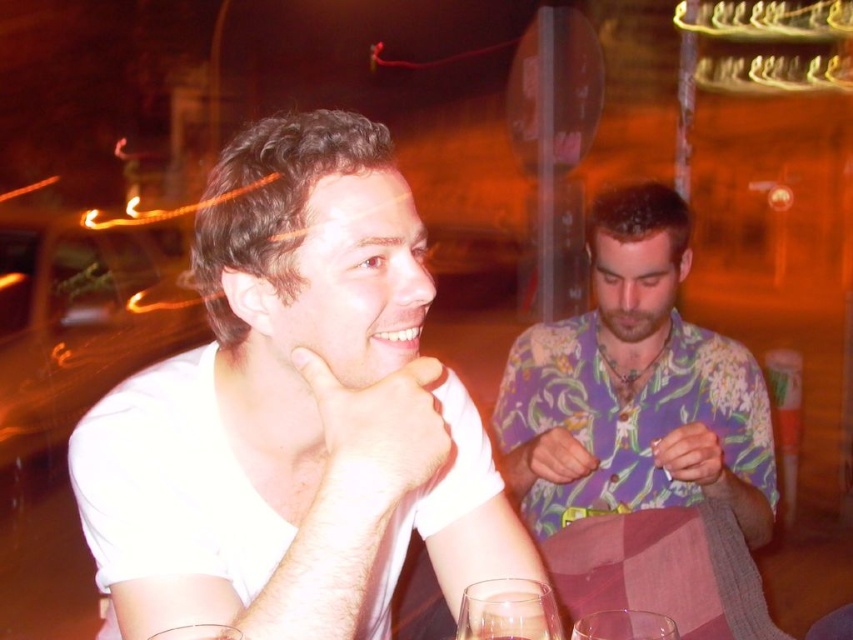
Who is more distant from viewer, (238, 589) or (485, 579)?

Point (238, 589)

Is white matte shirt at left smaller than clear glass wine glass at lower center?

Actually, white matte shirt at left might be larger than clear glass wine glass at lower center.

This screenshot has height=640, width=853. Describe the element at coordinates (294, 410) in the screenshot. I see `white matte shirt at left` at that location.

At what (x,y) coordinates should I click in order to perform the action: click on white matte shirt at left. Please return your answer as a coordinate pair (x, y). Looking at the image, I should click on (294, 410).

Which of these two, transparent glass at lower center or beardhairjaw at center, stands taller?

beardhairjaw at center

Does point (664, 628) come farther from viewer compared to point (668, 316)?

No.

At what (x,y) coordinates should I click in order to perform the action: click on transparent glass at lower center. Please return your answer as a coordinate pair (x, y). Looking at the image, I should click on coord(624,625).

Image resolution: width=853 pixels, height=640 pixels. Identify the location of transparent glass at lower center. (624, 625).

Between floral print shirt at center and beardhairjaw at center, which one appears on the left side from the viewer's perspective?

floral print shirt at center

Between point (642, 355) and point (625, 328), which one is positioned behind?

Positioned behind is point (642, 355).

The image size is (853, 640). What do you see at coordinates (634, 390) in the screenshot?
I see `floral print shirt at center` at bounding box center [634, 390].

You are a GUI agent. You are given a task and a screenshot of the screen. Output one action in this format:
    pyautogui.click(x=<x>, y=<y>)
    Task: Click on the floral print shirt at center
    This screenshot has height=640, width=853.
    Given the screenshot: What is the action you would take?
    634,390